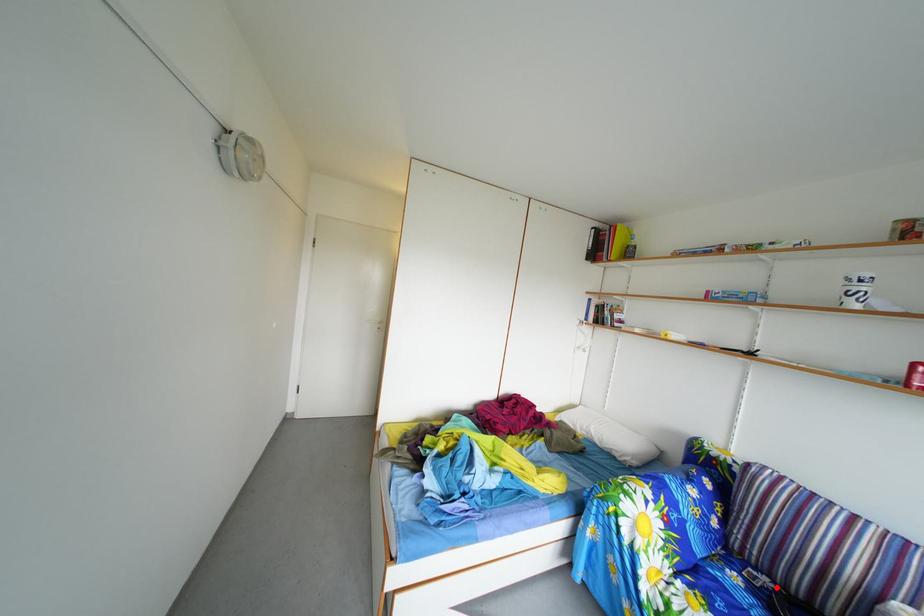
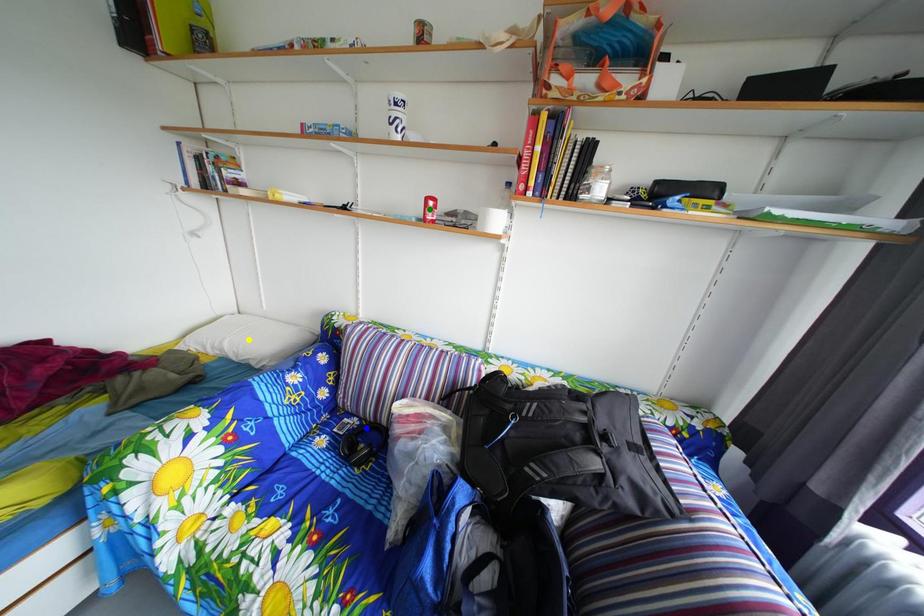
Question: I am providing you with two images of the same scene from different viewpoints. A red point is marked on the first image. You are given multiple points on the second image. Which mark in image 2 goes with the point in image 1?

Choices:
 (A) yellow point
 (B) green point
 (C) blue point

Answer: (C)